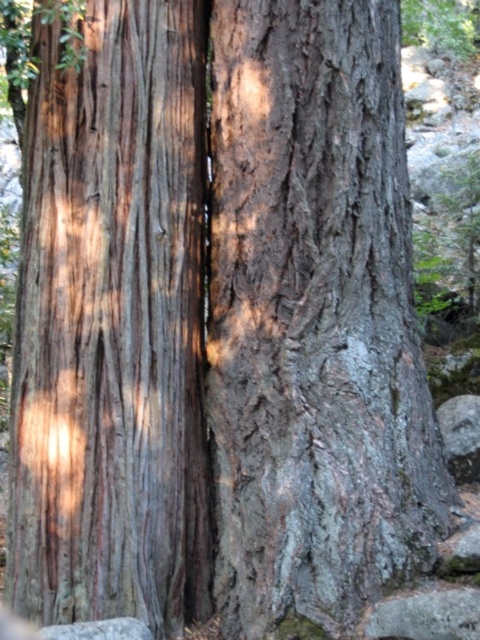
Question: Can you confirm if smooth brown bark at center is wider than gray rough stone at lower left?

Choices:
 (A) no
 (B) yes

Answer: (B)

Question: Is smooth brown bark at center closer to camera compared to gray rough stone at lower left?

Choices:
 (A) yes
 (B) no

Answer: (B)

Question: In this image, where is smooth brown bark at center located relative to gray rough stone at lower left?

Choices:
 (A) left
 (B) right

Answer: (B)

Question: Which object is farther from the camera taking this photo?

Choices:
 (A) smooth brown bark at center
 (B) gray rough stone at lower left

Answer: (A)

Question: Among these points, which one is nearest to the camera?

Choices:
 (A) 160,605
 (B) 144,625

Answer: (B)